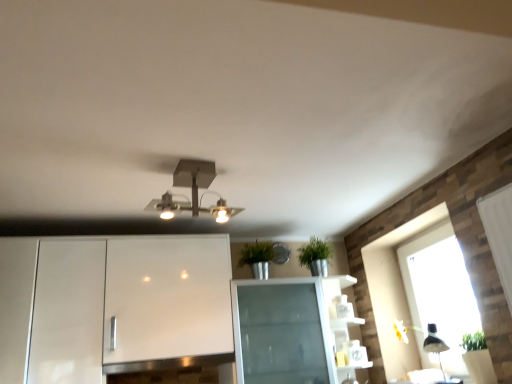
Question: Is black matte lamp at lower right a part of transparent glass window at right?

Choices:
 (A) yes
 (B) no

Answer: (B)

Question: Can you confirm if transparent glass window at right is taller than black matte lamp at lower right?

Choices:
 (A) no
 (B) yes

Answer: (B)

Question: From the image's perspective, is transparent glass window at right over black matte lamp at lower right?

Choices:
 (A) yes
 (B) no

Answer: (A)

Question: From the image's perspective, would you say transparent glass window at right is shown under black matte lamp at lower right?

Choices:
 (A) yes
 (B) no

Answer: (B)

Question: Can you confirm if transparent glass window at right is thinner than black matte lamp at lower right?

Choices:
 (A) no
 (B) yes

Answer: (B)

Question: Can you confirm if transparent glass window at right is positioned to the right of black matte lamp at lower right?

Choices:
 (A) no
 (B) yes

Answer: (B)

Question: From a real-world perspective, is black matte lamp at lower right below metallic square light fixture at center?

Choices:
 (A) yes
 (B) no

Answer: (A)

Question: Is black matte lamp at lower right positioned with its back to metallic square light fixture at center?

Choices:
 (A) yes
 (B) no

Answer: (B)

Question: Can you confirm if black matte lamp at lower right is thinner than metallic square light fixture at center?

Choices:
 (A) no
 (B) yes

Answer: (A)

Question: Considering the relative sizes of black matte lamp at lower right and metallic square light fixture at center in the image provided, is black matte lamp at lower right taller than metallic square light fixture at center?

Choices:
 (A) yes
 (B) no

Answer: (A)

Question: From the image's perspective, is black matte lamp at lower right above metallic square light fixture at center?

Choices:
 (A) no
 (B) yes

Answer: (A)

Question: From the image's perspective, is black matte lamp at lower right located beneath metallic square light fixture at center?

Choices:
 (A) no
 (B) yes

Answer: (B)

Question: Considering the relative sizes of metallic square light fixture at center and transparent glass window at right in the image provided, is metallic square light fixture at center smaller than transparent glass window at right?

Choices:
 (A) yes
 (B) no

Answer: (A)